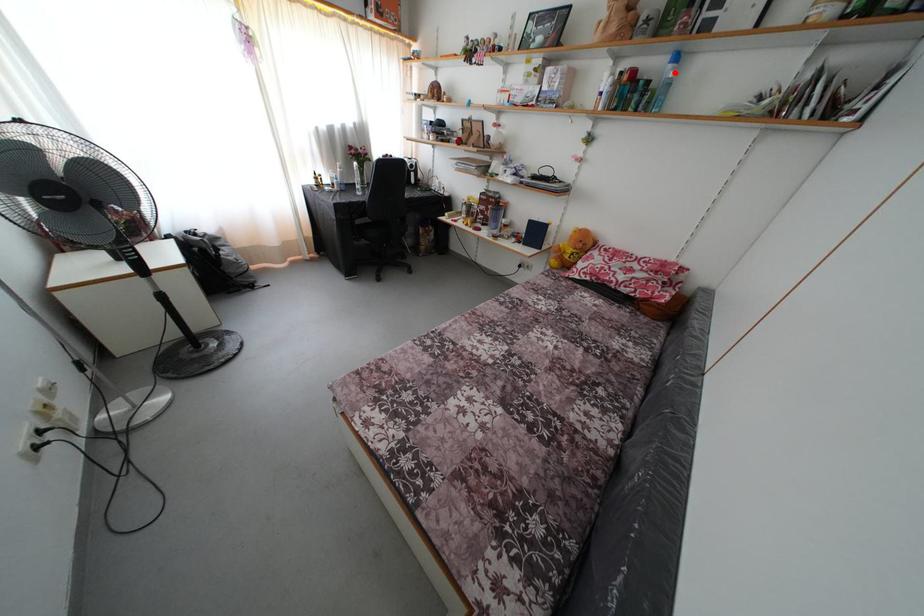
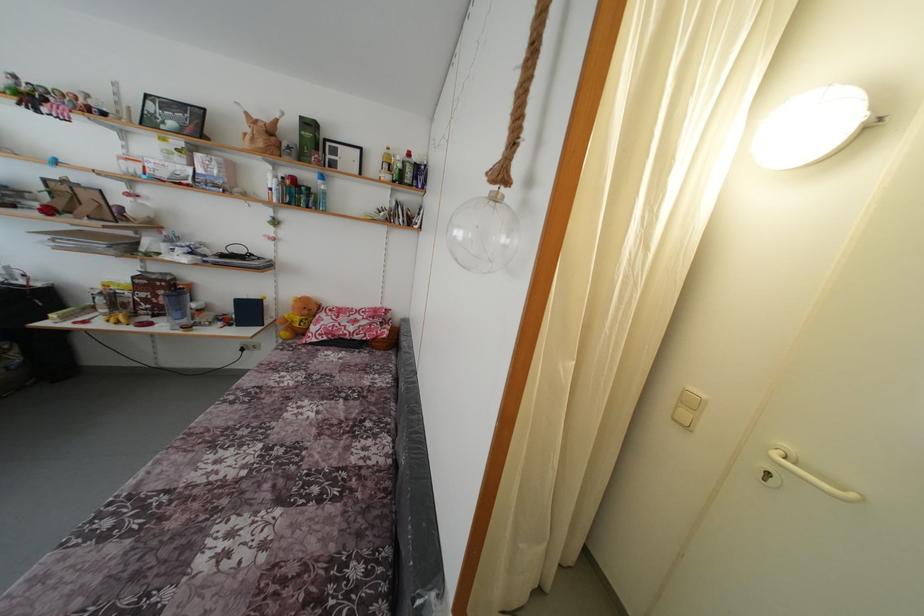
Locate, in the second image, the point that corresponds to the highlighted location in the first image.

(324, 188)